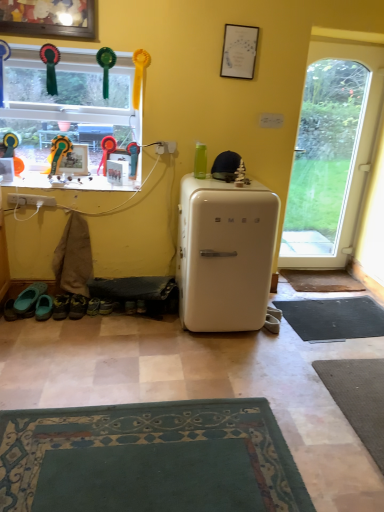
Question: Can you confirm if black rubber doormat at lower right is positioned to the left of teal fabric shoes at lower left, arranged as the second footwear when viewed from the left?

Choices:
 (A) yes
 (B) no

Answer: (B)

Question: Would you say black rubber doormat at lower right is a long distance from teal fabric shoes at lower left, which is counted as the second footwear, starting from the right?

Choices:
 (A) yes
 (B) no

Answer: (A)

Question: Can you confirm if black rubber doormat at lower right is shorter than teal fabric shoes at lower left, arranged as the second footwear when viewed from the left?

Choices:
 (A) no
 (B) yes

Answer: (B)

Question: Can you confirm if black rubber doormat at lower right is bigger than teal fabric shoes at lower left, which is counted as the second footwear, starting from the right?

Choices:
 (A) yes
 (B) no

Answer: (A)

Question: Is black rubber doormat at lower right turned away from teal fabric shoes at lower left, which is counted as the second footwear, starting from the right?

Choices:
 (A) no
 (B) yes

Answer: (A)

Question: Does point (142, 309) appear closer or farther from the camera than point (296, 163)?

Choices:
 (A) closer
 (B) farther

Answer: (A)

Question: Is green fabric shoe at lower left, the 2th shoe when ordered from left to right, in front of or behind transparent glass door at right in the image?

Choices:
 (A) front
 (B) behind

Answer: (A)

Question: From their relative heights in the image, would you say green fabric shoe at lower left, the 2th shoe when ordered from left to right, is taller or shorter than transparent glass door at right?

Choices:
 (A) tall
 (B) short

Answer: (B)

Question: Visually, is green fabric shoe at lower left, which is the first shoe in right-to-left order, positioned to the left or to the right of transparent glass door at right?

Choices:
 (A) right
 (B) left

Answer: (B)

Question: Based on their positions, is rubberized plastic toy at upper center, the 3th toy viewed from the left, located to the left or right of brown textured mat at lower right?

Choices:
 (A) left
 (B) right

Answer: (A)

Question: From a real-world perspective, is rubberized plastic toy at upper center, the 3th toy viewed from the left, above or below brown textured mat at lower right?

Choices:
 (A) above
 (B) below

Answer: (A)

Question: From the image's perspective, is rubberized plastic toy at upper center, the 3th toy viewed from the left, located above or below brown textured mat at lower right?

Choices:
 (A) above
 (B) below

Answer: (A)

Question: Is point (132, 162) closer or farther from the camera than point (306, 283)?

Choices:
 (A) closer
 (B) farther

Answer: (A)

Question: Is green fabric shoe at lower left, the 2th shoe when ordered from left to right, to the left or to the right of green rubber clogs at lower left, the third footwear positioned from the right, in the image?

Choices:
 (A) right
 (B) left

Answer: (A)

Question: Based on their sizes in the image, would you say green fabric shoe at lower left, which is the first shoe in right-to-left order, is bigger or smaller than green rubber clogs at lower left, the third footwear positioned from the right?

Choices:
 (A) small
 (B) big

Answer: (A)